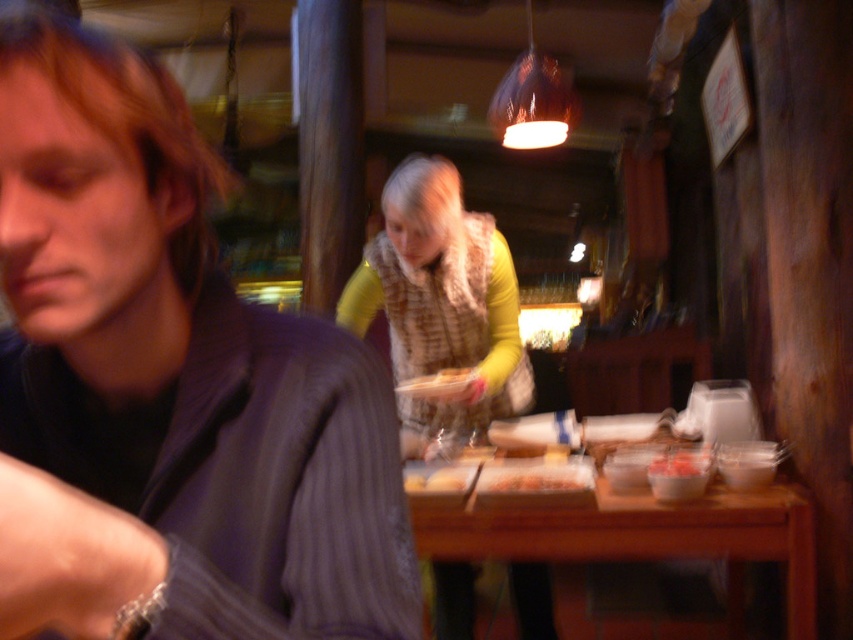
Question: Which of the following is the farthest from the observer?

Choices:
 (A) (444, 212)
 (B) (26, 612)
 (C) (444, 394)

Answer: (C)

Question: Is yellow-green sweater at center to the left of wooden table at lower right from the viewer's perspective?

Choices:
 (A) yes
 (B) no

Answer: (A)

Question: Estimate the real-world distances between objects in this image. Which object is farther from the smooth white rice at center?

Choices:
 (A) wooden table at lower right
 (B) dark gray striped shirt at left
 (C) yellow-green sweater at center
 (D) smooth white bread at center

Answer: (B)

Question: Which object is farther from the camera taking this photo?

Choices:
 (A) smooth pinkish-red paste at lower center
 (B) smooth white bread at center
 (C) smooth white rice at center

Answer: (B)

Question: Can you confirm if wooden table at lower right is bigger than smooth white bread at center?

Choices:
 (A) no
 (B) yes

Answer: (B)

Question: Is dark gray striped shirt at left to the left of smooth white bread at center from the viewer's perspective?

Choices:
 (A) yes
 (B) no

Answer: (A)